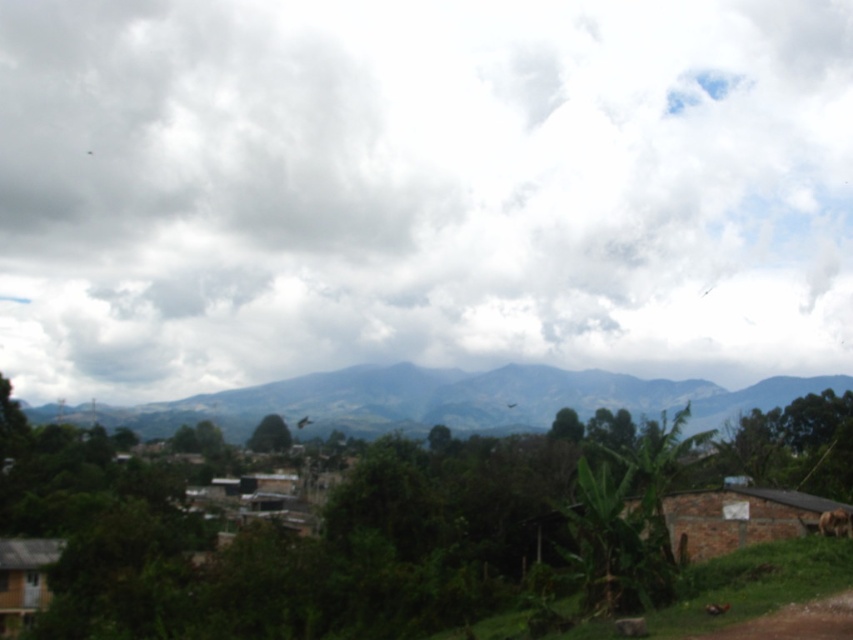
In the scene shown: Between white fluffy cloud at upper center and brown furry dog at lower right, which one has less height?

With less height is brown furry dog at lower right.

How far apart are white fluffy cloud at upper center and brown furry dog at lower right?

white fluffy cloud at upper center and brown furry dog at lower right are 314.46 meters apart from each other.

Is point (708, 36) farther from viewer compared to point (840, 529)?

Yes, it is behind point (840, 529).

Where is `white fluffy cloud at upper center`? The height and width of the screenshot is (640, 853). white fluffy cloud at upper center is located at coordinates (421, 189).

Between green textured mountain at center and brown dirt track at lower right, which one appears on the left side from the viewer's perspective?

brown dirt track at lower right

Who is taller, green textured mountain at center or brown dirt track at lower right?

Standing taller between the two is green textured mountain at center.

Is point (508, 371) in front of point (796, 604)?

No.

You are a GUI agent. You are given a task and a screenshot of the screen. Output one action in this format:
    pyautogui.click(x=<x>, y=<y>)
    Task: Click on the green textured mountain at center
    This screenshot has height=640, width=853.
    Given the screenshot: What is the action you would take?
    pyautogui.click(x=456, y=401)

Who is shorter, green textured mountain at center or wooden hut at lower left?

wooden hut at lower left

This screenshot has width=853, height=640. What do you see at coordinates (456, 401) in the screenshot?
I see `green textured mountain at center` at bounding box center [456, 401].

Image resolution: width=853 pixels, height=640 pixels. I want to click on green textured mountain at center, so click(456, 401).